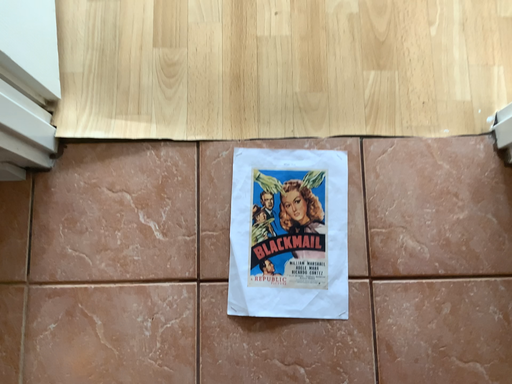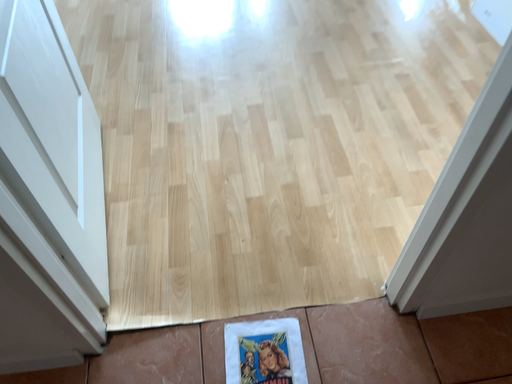
Question: How did the camera likely rotate when shooting the video?

Choices:
 (A) rotated upward
 (B) rotated downward

Answer: (A)